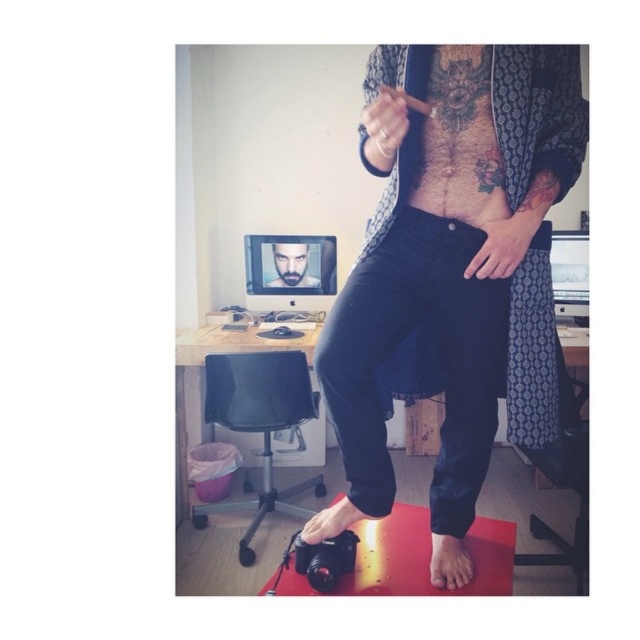
You are a photographer adjusting your camera settings. You notice the dark skin tattooed torso at center and the smooth skin face at center in your frame. Which subject is more in focus if your camera is focused on the closer object?

The dark skin tattooed torso at center is closer to the viewer than the smooth skin face at center, so if the camera is focused on the closer object, the dark skin tattooed torso at center will be more in focus.

What are the coordinates of the dark skin tattooed torso at center?

The dark skin tattooed torso at center is located at point (460, 140).